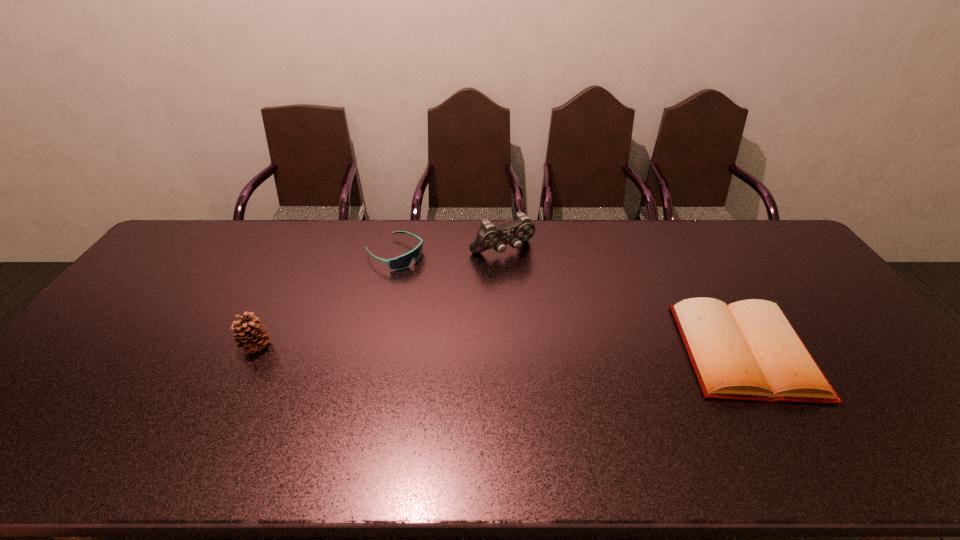
At what (x,y) coordinates should I click in order to perform the action: click on blank space located 0.220m on the surface of the second object from right to left with buttons. Please return your answer as a coordinate pair (x, y). Image resolution: width=960 pixels, height=540 pixels. Looking at the image, I should click on (545, 307).

The image size is (960, 540). Find the location of `free space located on the front-facing side of the second shortest object`. free space located on the front-facing side of the second shortest object is located at coordinates (427, 274).

Find the location of a particular element. vacant region located 0.300m on the front-facing side of the second shortest object is located at coordinates (484, 309).

Find the location of a particular element. This screenshot has height=540, width=960. free space located 0.100m on the front-facing side of the second shortest object is located at coordinates (436, 279).

Locate an element on the screen. The image size is (960, 540). control that is at the far edge is located at coordinates (489, 236).

Find the location of a particular element. sunglasses located at the far edge is located at coordinates (403, 261).

The height and width of the screenshot is (540, 960). What are the coordinates of `object that is at the near edge` in the screenshot? It's located at (748, 350).

This screenshot has width=960, height=540. Find the location of `vacant space at the far edge of the desktop`. vacant space at the far edge of the desktop is located at coordinates (347, 224).

In the image, there is a desktop. Identify the location of vacant space at the near edge. The width and height of the screenshot is (960, 540). (270, 415).

Where is `vacant region at the left edge`? vacant region at the left edge is located at coordinates (174, 293).